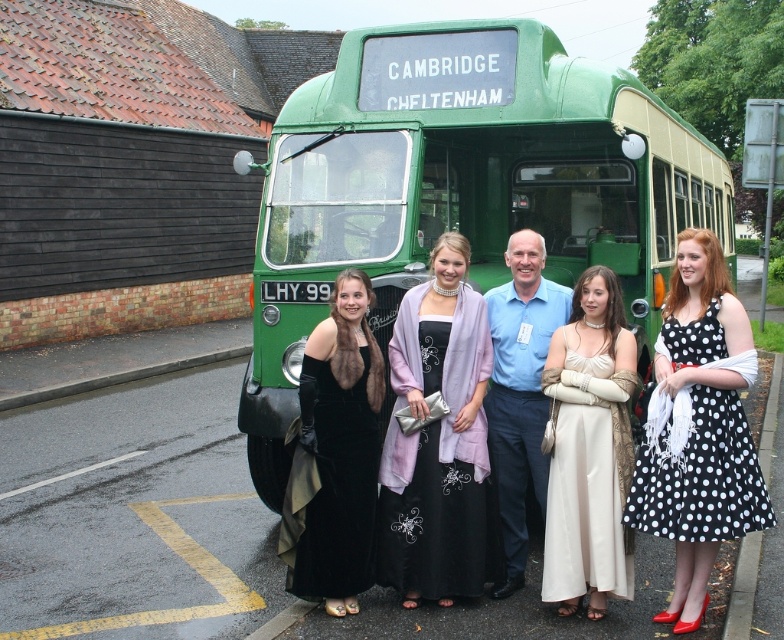
Question: Which of these objects is positioned closest to the lavender satin dress at center?

Choices:
 (A) velvet black dress at center
 (B) blue cotton shirt at center
 (C) black polka dot dress at center

Answer: (B)

Question: Can you confirm if lavender satin dress at center is positioned below blue cotton shirt at center?

Choices:
 (A) yes
 (B) no

Answer: (A)

Question: Among these points, which one is farthest from the camera?

Choices:
 (A) (x=670, y=513)
 (B) (x=592, y=72)
 (C) (x=750, y=157)
 (D) (x=559, y=360)

Answer: (C)

Question: Which point appears closest to the camera in this image?

Choices:
 (A) (351, 452)
 (B) (416, 561)
 (C) (612, 310)

Answer: (C)

Question: Is velvet black dress at center further to camera compared to green metal pole at upper right?

Choices:
 (A) yes
 (B) no

Answer: (B)

Question: Can you confirm if green polished wood decker bus at center is positioned to the left of black polka dot dress at center?

Choices:
 (A) yes
 (B) no

Answer: (A)